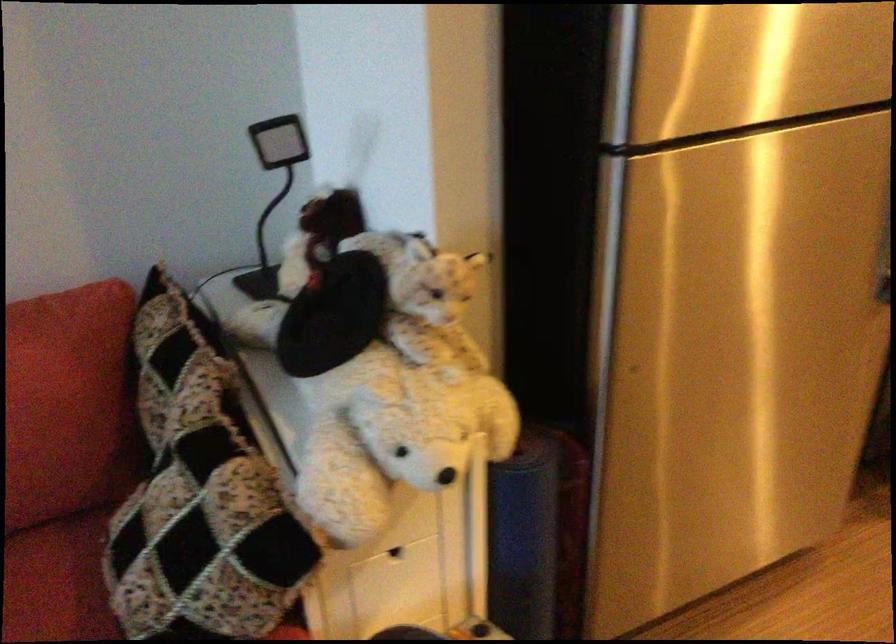
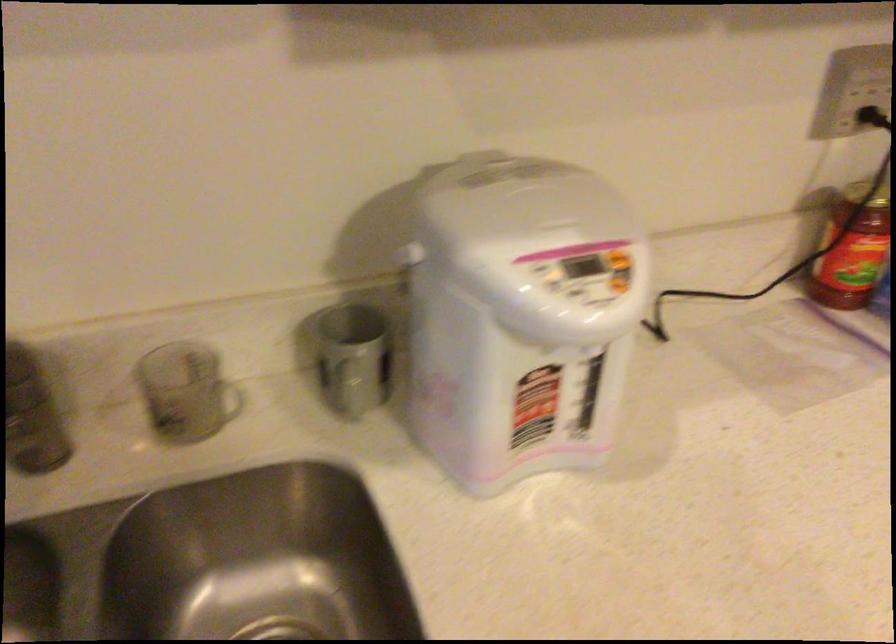
The images are taken continuously from a first-person perspective. In which direction are you moving?

The movement direction of the cameraman is right, forward.